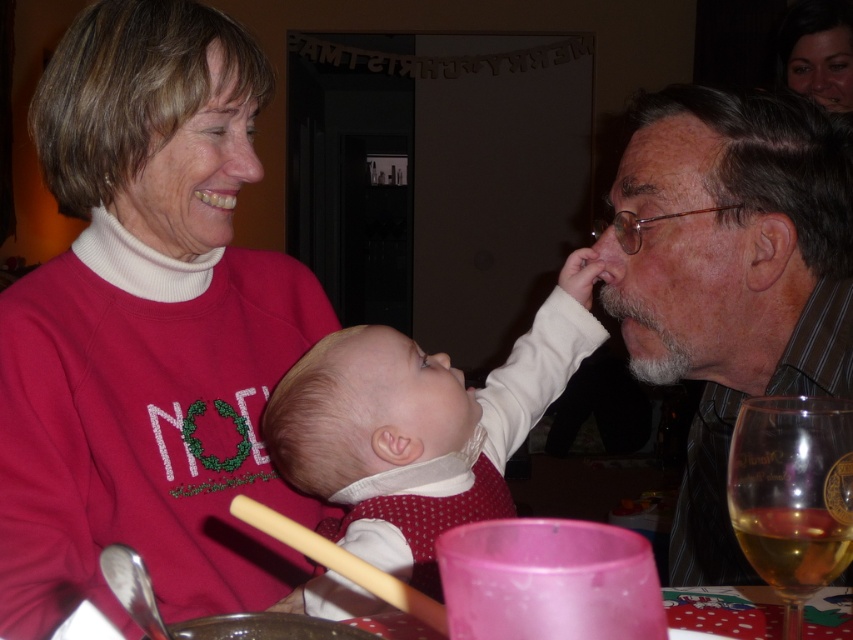
Question: Does white soft baby at center come behind wooden chopstick at lower center?

Choices:
 (A) yes
 (B) no

Answer: (A)

Question: Which object is farther from the camera taking this photo?

Choices:
 (A) white soft baby at center
 (B) smooth skin face at upper right
 (C) gray striped shirt at right

Answer: (B)

Question: Does gray striped shirt at right have a lesser width compared to smooth skin face at upper right?

Choices:
 (A) no
 (B) yes

Answer: (A)

Question: Which point is closer to the camera?

Choices:
 (A) (136, 401)
 (B) (788, 512)
 (C) (444, 468)

Answer: (B)

Question: Which of the following is the farthest from the observer?

Choices:
 (A) (134, 284)
 (B) (300, 545)
 (C) (828, 525)

Answer: (A)

Question: Can you confirm if smooth skin face at upper right is thinner than wooden chopstick at lower center?

Choices:
 (A) yes
 (B) no

Answer: (B)